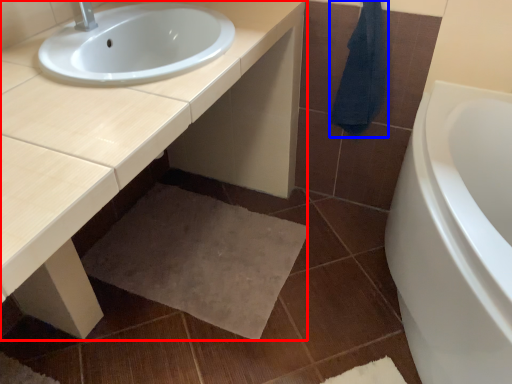
Question: Among these objects, which one is nearest to the camera, countertop (highlighted by a red box) or bath towel (highlighted by a blue box)?

Choices:
 (A) countertop
 (B) bath towel

Answer: (A)